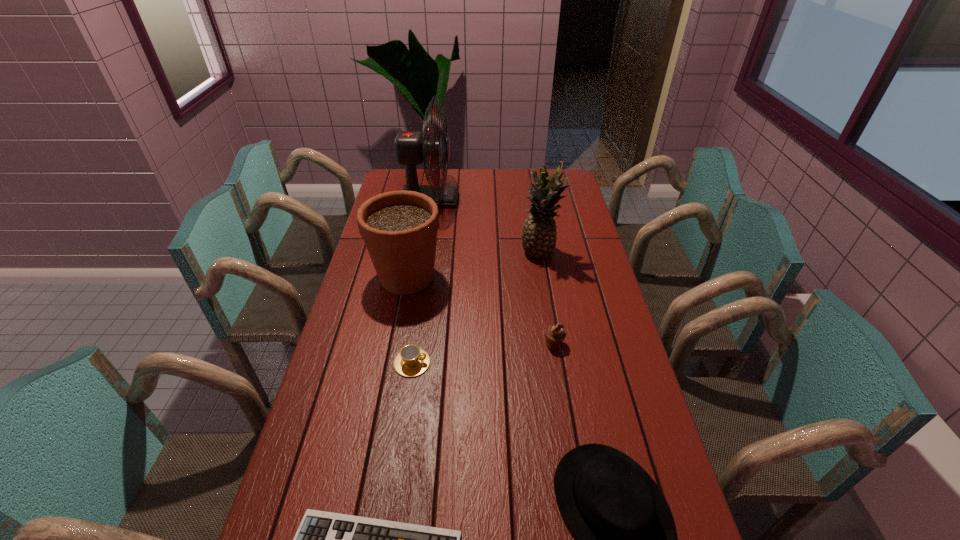
The width and height of the screenshot is (960, 540). Identify the location of the tallest object. (411, 147).

At what (x,y) coordinates should I click in order to perform the action: click on fan. Please return your answer as a coordinate pair (x, y). Looking at the image, I should click on pyautogui.click(x=411, y=147).

I want to click on the sixth shortest object, so click(539, 232).

Where is `flowerpot`? flowerpot is located at coordinates (399, 228).

Where is `muffin`? muffin is located at coordinates (554, 334).

Where is `the sixth tallest object`? This screenshot has height=540, width=960. the sixth tallest object is located at coordinates (411, 361).

What are the coordinates of `free region located on the front-facing side of the farthest object` in the screenshot? It's located at (482, 200).

The image size is (960, 540). I want to click on vacant position located on the front of the second tallest object, so click(545, 287).

This screenshot has width=960, height=540. Find the location of `vacant space located 0.310m on the right of the third tallest object`. vacant space located 0.310m on the right of the third tallest object is located at coordinates (531, 276).

I want to click on free region located on the back of the muffin, so click(550, 319).